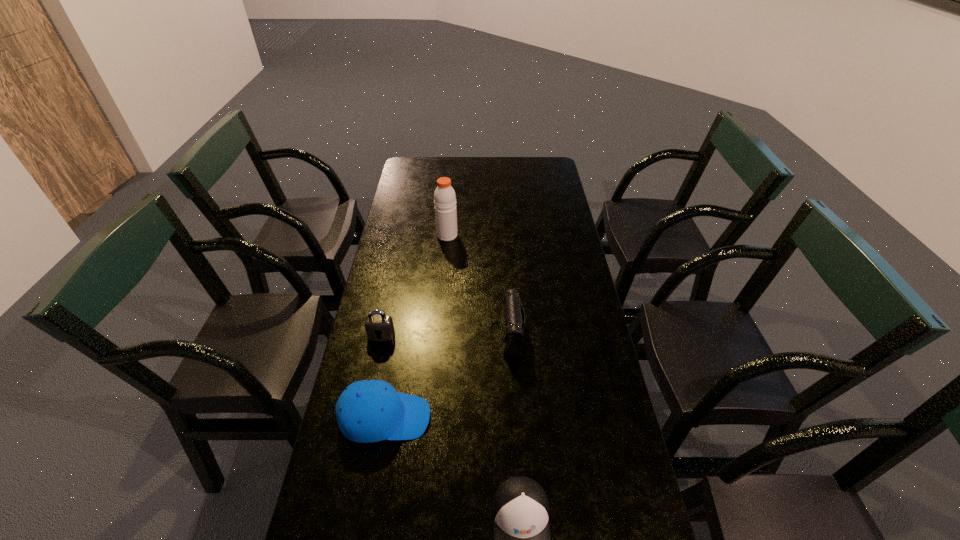
This screenshot has height=540, width=960. In order to click on vacant space that is in between the padlock and the tallest object in this screenshot , I will do `click(415, 285)`.

Locate an element on the screen. The image size is (960, 540). free spot between the padlock and the farthest object is located at coordinates (415, 285).

Locate which object ranks fourth in proximity to the padlock. Please provide its 2D coordinates. Your answer should be formatted as a tuple, i.e. [(x, y)], where the tuple contains the x and y coordinates of a point satisfying the conditions above.

[(520, 507)]

Point out which object is positioned as the third nearest to the shaker. Please provide its 2D coordinates. Your answer should be formatted as a tuple, i.e. [(x, y)], where the tuple contains the x and y coordinates of a point satisfying the conditions above.

[(368, 411)]

Where is `vacant space that satisfies the following two spatial constraints: 1. on the front flap of the clutch bag; 2. at the front of the padlock near the keyhole`? This screenshot has height=540, width=960. vacant space that satisfies the following two spatial constraints: 1. on the front flap of the clutch bag; 2. at the front of the padlock near the keyhole is located at coordinates (507, 335).

Where is `free space in the image that satisfies the following two spatial constraints: 1. on the front side of the tallest object; 2. on the front-facing side of the fourth farthest object`? free space in the image that satisfies the following two spatial constraints: 1. on the front side of the tallest object; 2. on the front-facing side of the fourth farthest object is located at coordinates (431, 417).